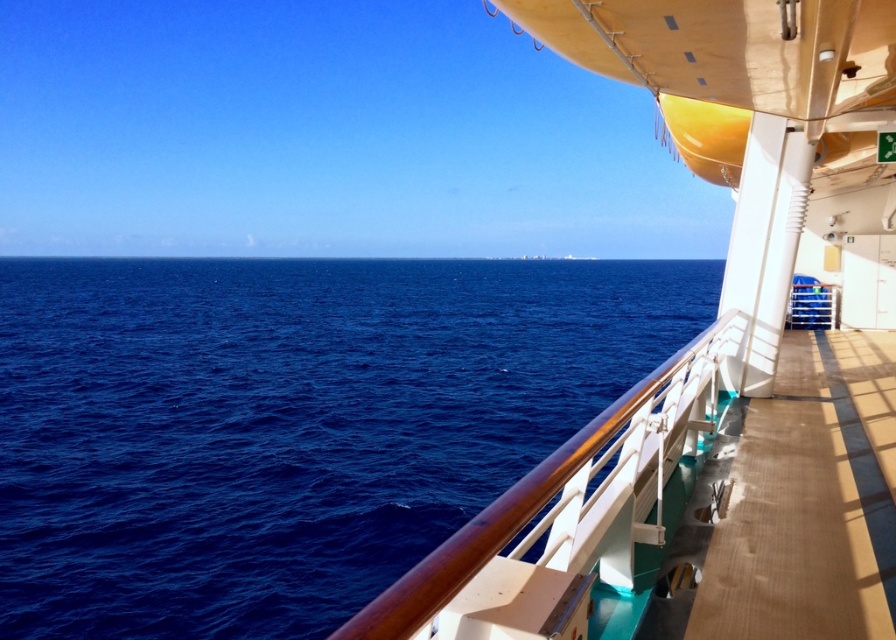
Can you confirm if deep blue water at center is taller than white glossy boat at right?

Yes, deep blue water at center is taller than white glossy boat at right.

Describe the element at coordinates (289, 422) in the screenshot. I see `deep blue water at center` at that location.

The width and height of the screenshot is (896, 640). Identify the location of deep blue water at center. (289, 422).

From the picture: Between deep blue water at center and wooden at right, which one appears on the right side from the viewer's perspective?

wooden at right is more to the right.

Is deep blue water at center positioned before wooden at right?

Yes, deep blue water at center is closer to the viewer.

The image size is (896, 640). Describe the element at coordinates (289, 422) in the screenshot. I see `deep blue water at center` at that location.

Where is `deep blue water at center`? deep blue water at center is located at coordinates (289, 422).

Which of these two, deep blue water at center or brown polished wood at right, stands shorter?

brown polished wood at right is shorter.

Who is more forward, (401, 456) or (711, 433)?

Point (711, 433) is in front.

Is point (209, 577) more distant than point (532, 616)?

Yes, it is.

The height and width of the screenshot is (640, 896). Find the location of `deep blue water at center`. deep blue water at center is located at coordinates (289, 422).